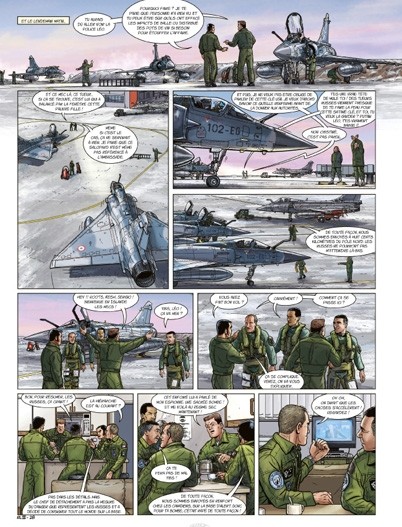
I want to click on cup, so click(294, 508), click(210, 476), click(94, 439).